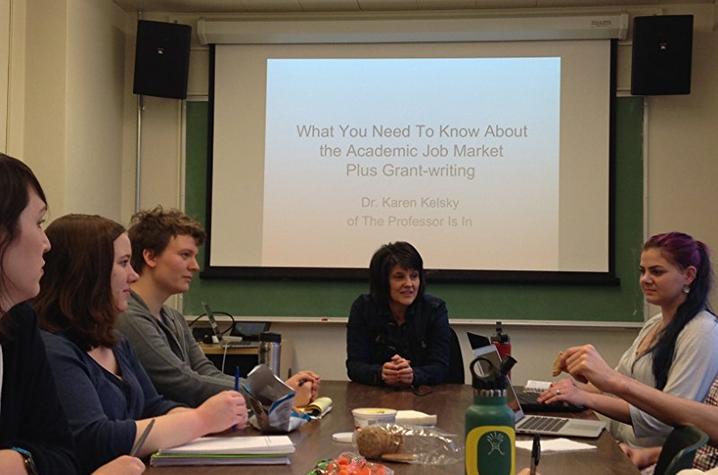
Locate an element on the screen. speakers is located at coordinates (x=676, y=64), (x=179, y=58).